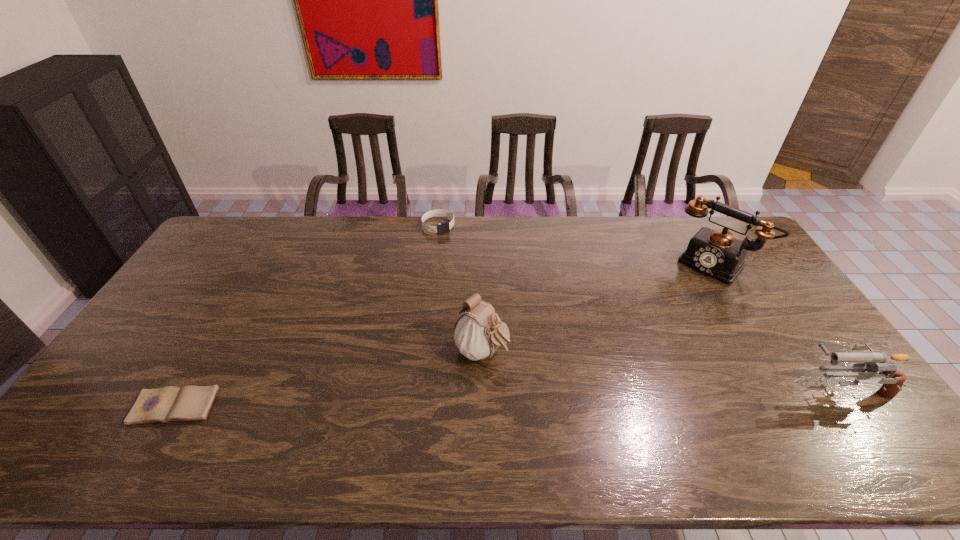
Where is `free space between the second object from left to right and the pouch`? Image resolution: width=960 pixels, height=540 pixels. free space between the second object from left to right and the pouch is located at coordinates (460, 289).

This screenshot has width=960, height=540. In order to click on empty space that is in between the fourth tallest object and the telephone in this screenshot , I will do `click(577, 245)`.

Locate an element on the screen. This screenshot has width=960, height=540. vacant point located between the leftmost object and the tallest object is located at coordinates (445, 335).

You are a GUI agent. You are given a task and a screenshot of the screen. Output one action in this format:
    pyautogui.click(x=<x>, y=<y>)
    Task: Click on the free space between the shortest object and the third shortest object
    The height and width of the screenshot is (540, 960).
    Given the screenshot: What is the action you would take?
    pyautogui.click(x=510, y=397)

I want to click on free spot between the wristband and the third object from right to left, so click(x=460, y=289).

Where is `object identified as the fourth closest to the shortest object`? This screenshot has height=540, width=960. object identified as the fourth closest to the shortest object is located at coordinates (872, 362).

Point out which object is positioned as the nearest to the wristband. Please provide its 2D coordinates. Your answer should be formatted as a tuple, i.e. [(x, y)], where the tuple contains the x and y coordinates of a point satisfying the conditions above.

[(478, 332)]

At what (x,y) coordinates should I click in order to perform the action: click on vacant region that satisfies the following two spatial constraints: 1. on the back side of the tallest object; 2. on the right side of the diary. Please return your answer as a coordinate pair (x, y). This screenshot has height=540, width=960. Looking at the image, I should click on (257, 264).

The width and height of the screenshot is (960, 540). I want to click on vacant space that satisfies the following two spatial constraints: 1. on the front side of the third object from left to right; 2. on the right side of the wristband, so click(x=423, y=352).

Identify the location of free region that satisfies the following two spatial constraints: 1. on the back side of the farthest object; 2. on the left side of the diary. This screenshot has height=540, width=960. (279, 226).